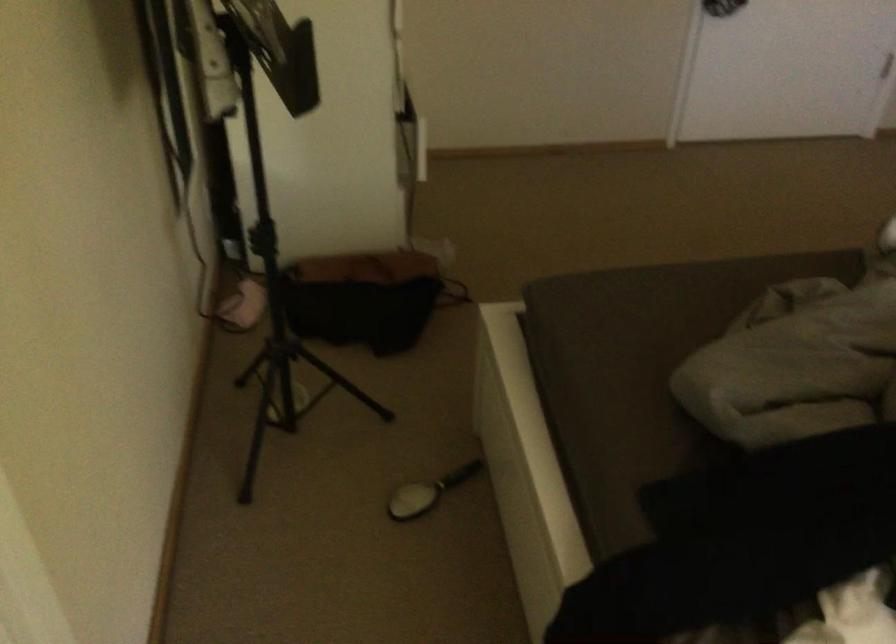
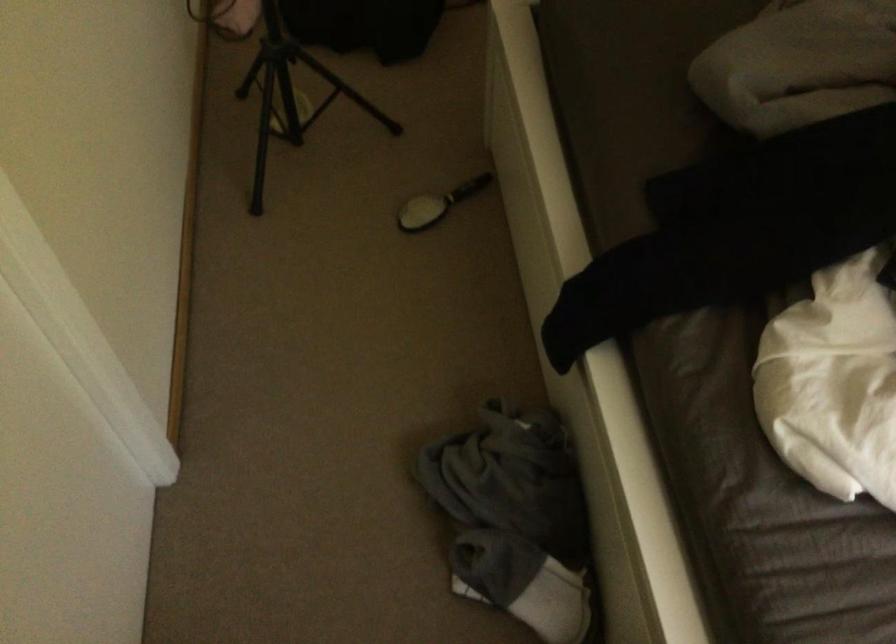
Where in the second image is the point corresponding to pixel 429 496 from the first image?

(437, 204)